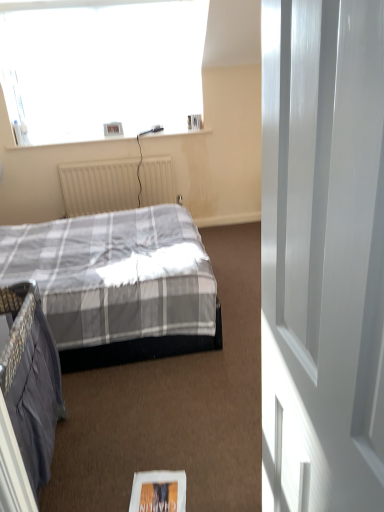
Question: In terms of height, does white paper magazine at lower center look taller or shorter compared to beige textured radiator at center?

Choices:
 (A) tall
 (B) short

Answer: (B)

Question: In the image, is white paper magazine at lower center positioned in front of or behind beige textured radiator at center?

Choices:
 (A) front
 (B) behind

Answer: (A)

Question: Considering the real-world distances, which object is closest to the white glossy door at right?

Choices:
 (A) beige textured radiator at center
 (B) white paper magazine at lower center

Answer: (B)

Question: Which object is positioned closest to the white glossy door at right?

Choices:
 (A) white paper magazine at lower center
 (B) beige textured radiator at center

Answer: (A)